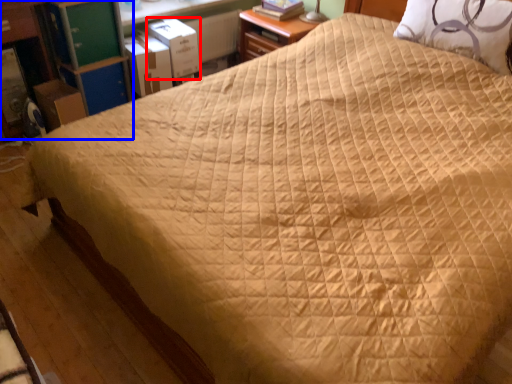
Question: Which point is further to the camera, cardboard box (highlighted by a red box) or dresser (highlighted by a blue box)?

Choices:
 (A) cardboard box
 (B) dresser

Answer: (A)